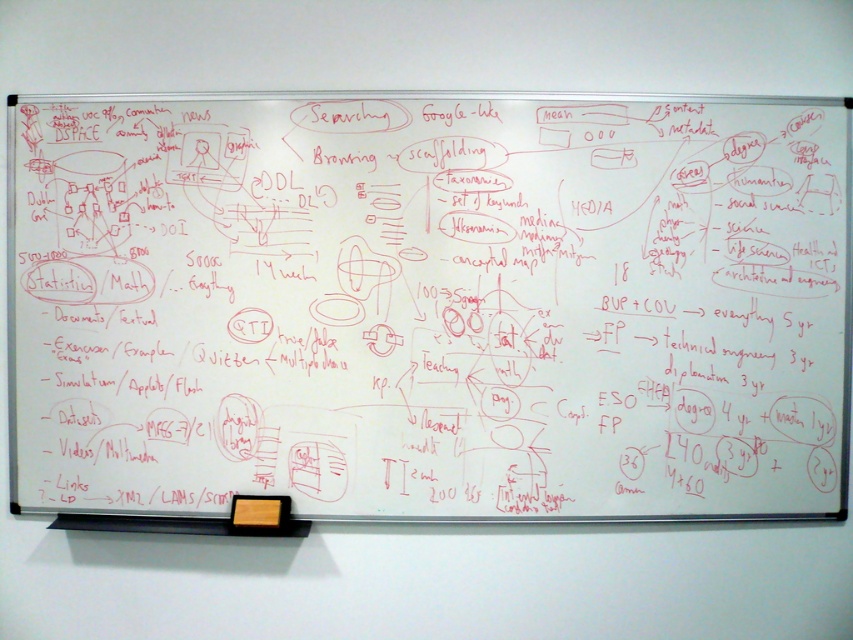
Question: Which point is farther to the camera?

Choices:
 (A) (274, 499)
 (B) (347, 328)

Answer: (A)

Question: Where is whiteboard at upper center located in relation to orange matte sticky note at lower center in the image?

Choices:
 (A) below
 (B) above

Answer: (B)

Question: Is whiteboard at upper center smaller than orange matte sticky note at lower center?

Choices:
 (A) no
 (B) yes

Answer: (A)

Question: Which point appears closest to the camera in this image?

Choices:
 (A) click(x=242, y=499)
 (B) click(x=743, y=420)

Answer: (A)

Question: Is whiteboard at upper center thinner than orange matte sticky note at lower center?

Choices:
 (A) yes
 (B) no

Answer: (B)

Question: Which point is closer to the camera?

Choices:
 (A) (263, 513)
 (B) (166, 236)

Answer: (A)